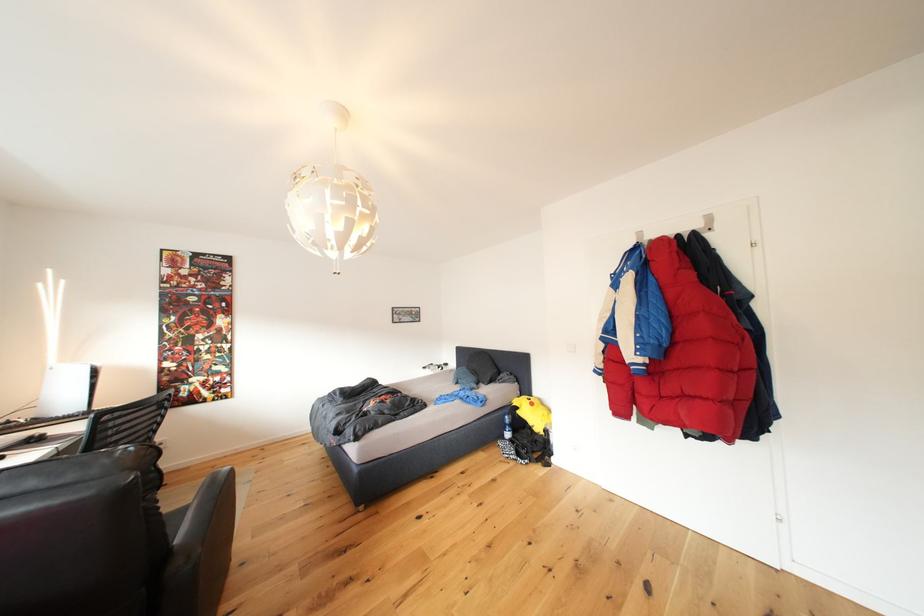
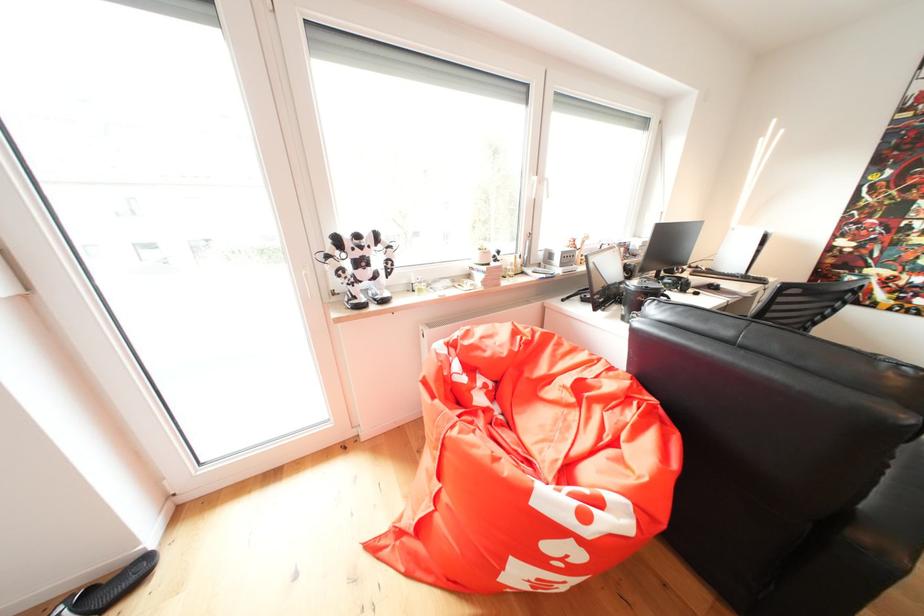
First-person continuous shooting, in which direction is the camera rotating?

The camera rotated toward left-down.